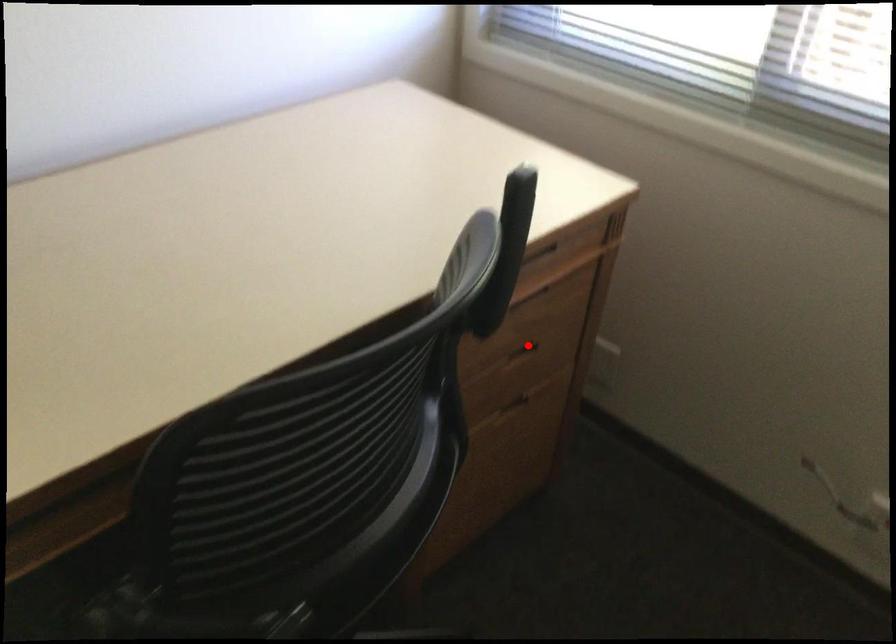
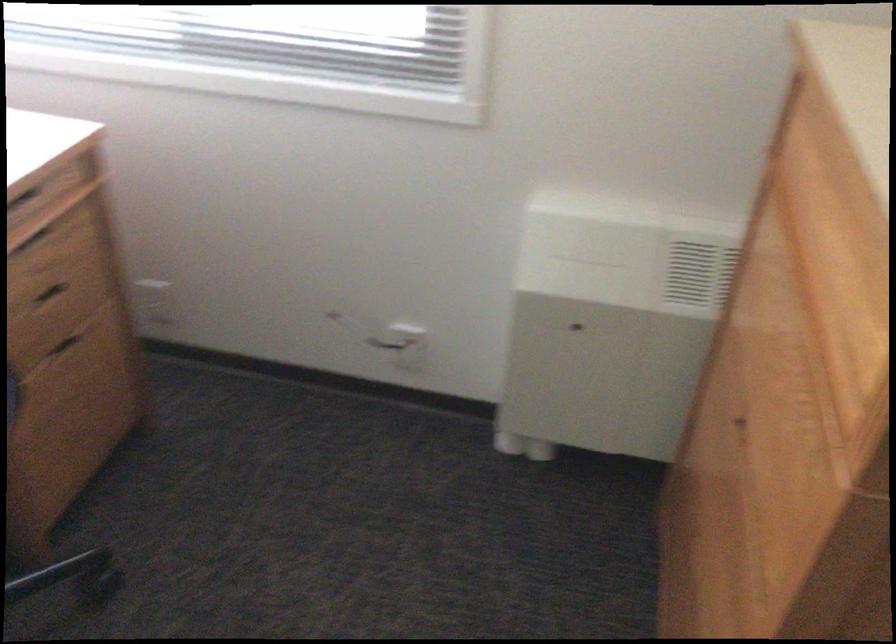
The point at the highlighted location is marked in the first image. Where is the corresponding point in the second image?

(49, 292)